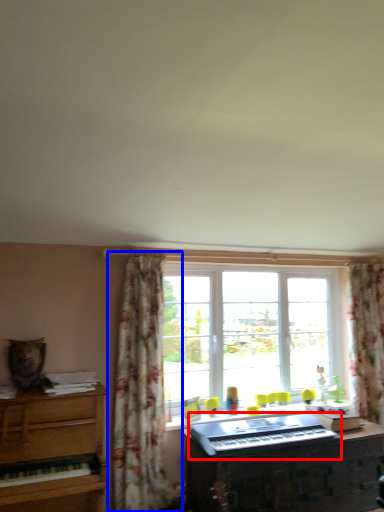
Question: Which point is further to the camera, musical keyboard (highlighted by a red box) or curtain (highlighted by a blue box)?

Choices:
 (A) musical keyboard
 (B) curtain

Answer: (B)